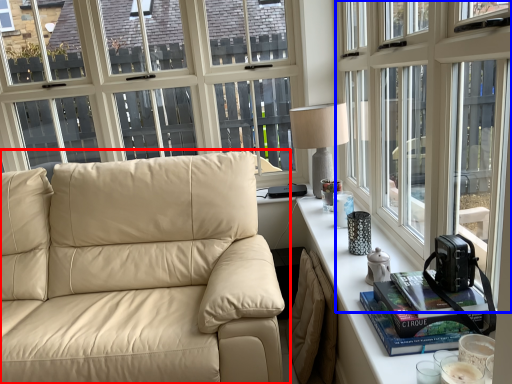
Question: Which object appears closest to the camera in this image, studio couch (highlighted by a red box) or window (highlighted by a blue box)?

Choices:
 (A) studio couch
 (B) window

Answer: (B)